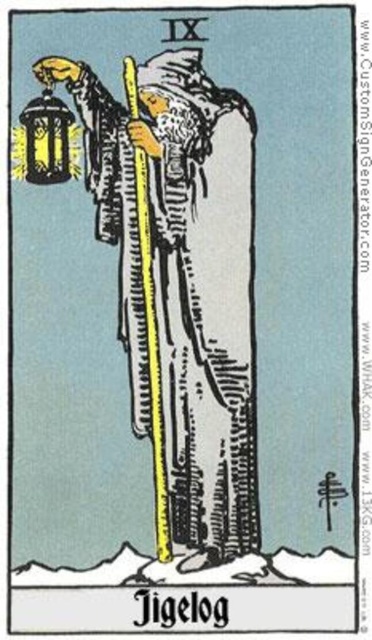
You are an artist trying to draw the Jigelog tarot card. You want to ensure the two points, point (159, 72) and point (27, 173), are placed correctly in terms of depth. Which point should you draw larger to indicate it is closer to the viewer?

Point (159, 72) should be drawn larger because it is closer to the camera than point (27, 173), and objects closer to the viewer appear larger in size.

Consider the image. You are a tarot reader analyzing the Jigelog card. You notice the yellow wood pole at center and the metallic lantern at left. Which object is located below the other?

The yellow wood pole at center is positioned under the metallic lantern at left, meaning the pole is below the lantern.

You are an artist trying to sketch the Jigelog tarot card. You notice the yellow wood pole at center and the metallic lantern at left. Which object should you draw first if you want to ensure proper proportions, considering their widths?

You should draw the metallic lantern at left first because it has a greater width than the yellow wood pole at center, allowing you to establish the broader shape before detailing the narrower one.